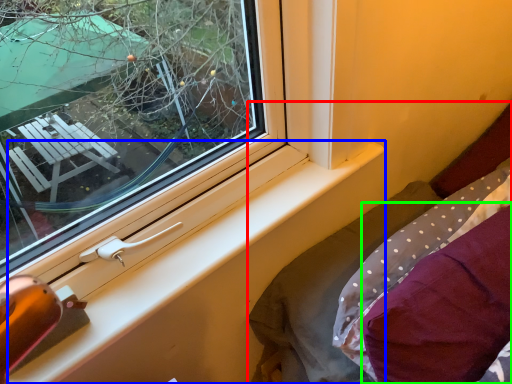
Question: Which is nearer to the bed (highlighted by a red box)? window sill (highlighted by a blue box) or pillow (highlighted by a green box).

Choices:
 (A) window sill
 (B) pillow

Answer: (B)